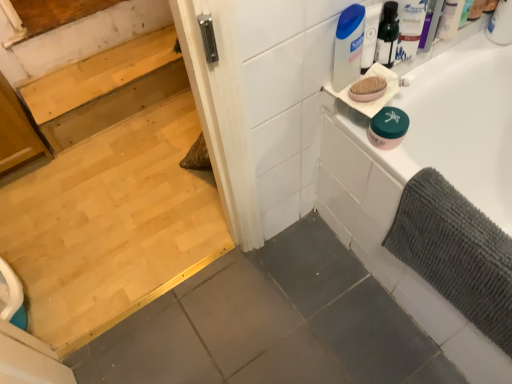
This screenshot has height=384, width=512. I want to click on empty space that is ontop of gray textured bath mat at right (from a real-world perspective), so click(463, 222).